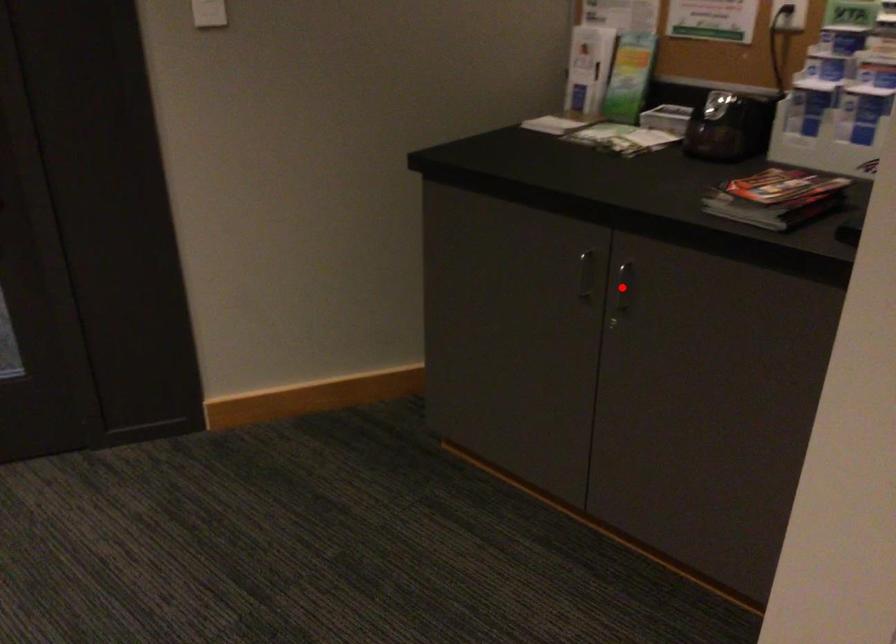
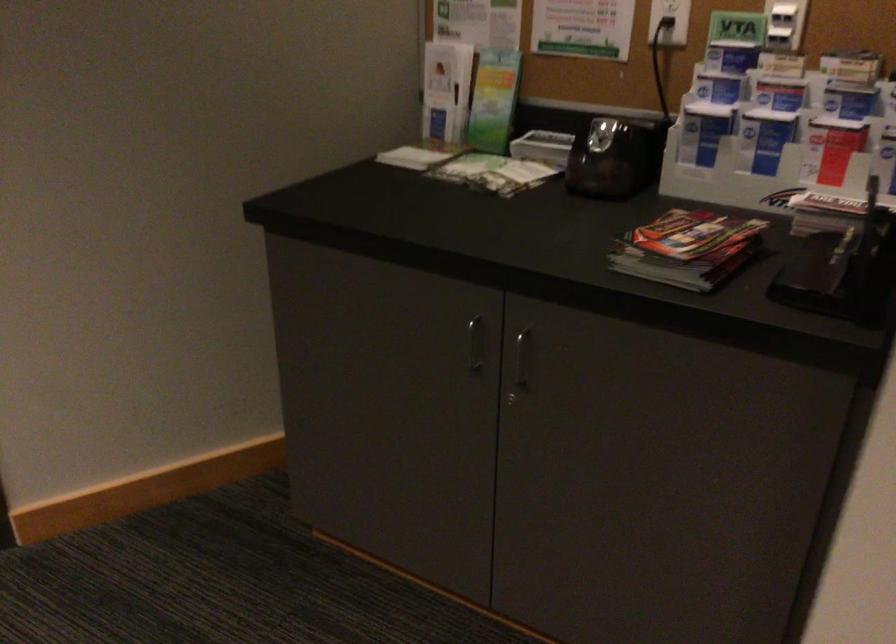
Question: I am providing you with two images of the same scene from different viewpoints. In image1, a red point is highlighted. Considering the same 3D point in image2, which of the following is correct?

Choices:
 (A) It is closer
 (B) It is farther

Answer: (A)